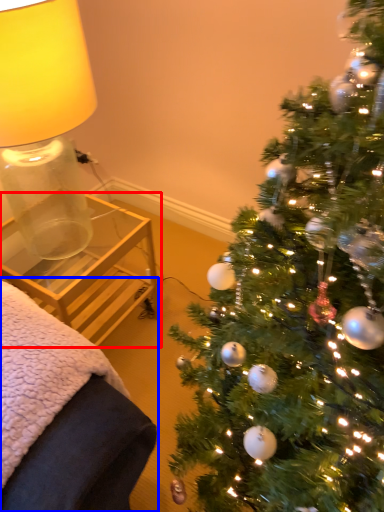
Question: Which of the following is the farthest to the observer, table (highlighted by a red box) or furniture (highlighted by a blue box)?

Choices:
 (A) table
 (B) furniture

Answer: (A)